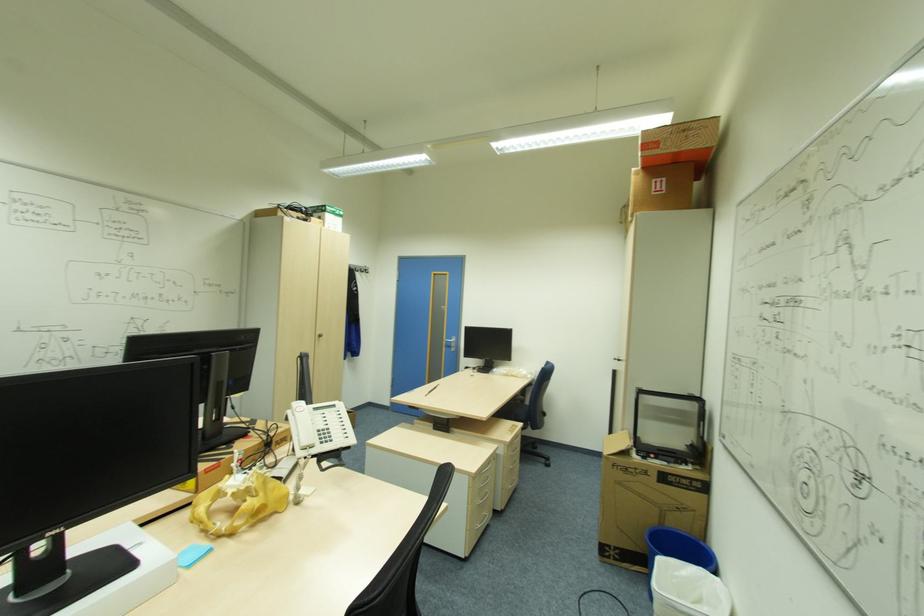
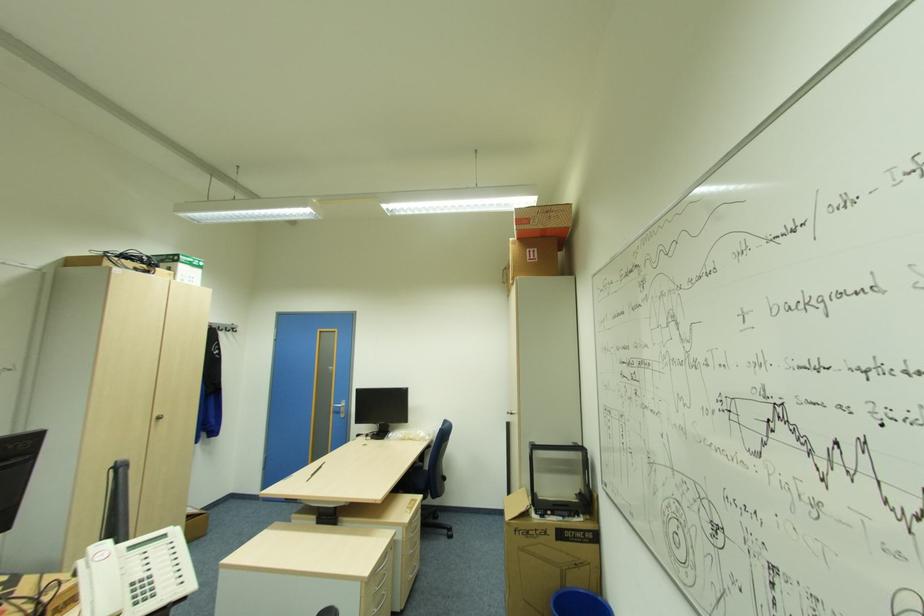
Question: How did the camera likely rotate?

Choices:
 (A) Left
 (B) Right
 (C) Up
 (D) Down

Answer: (B)